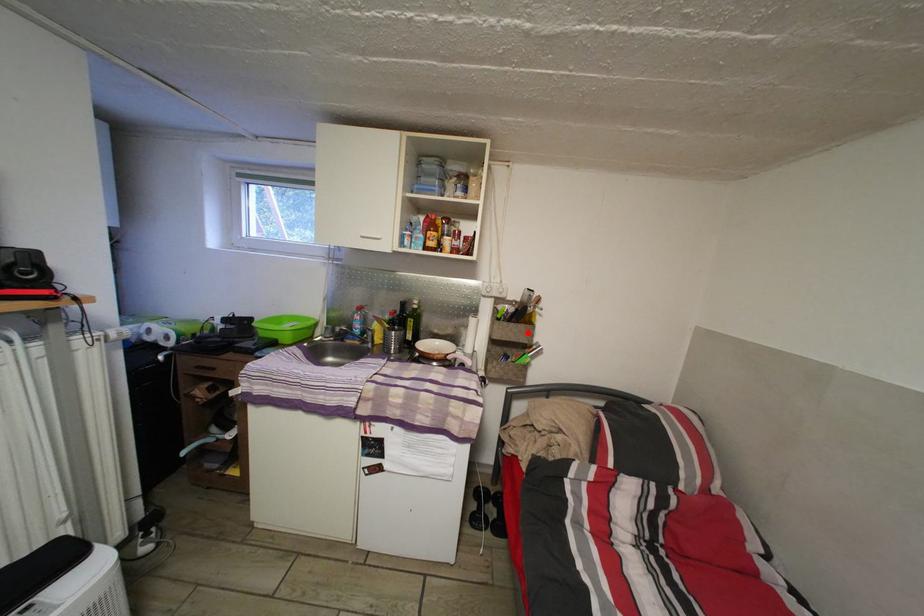
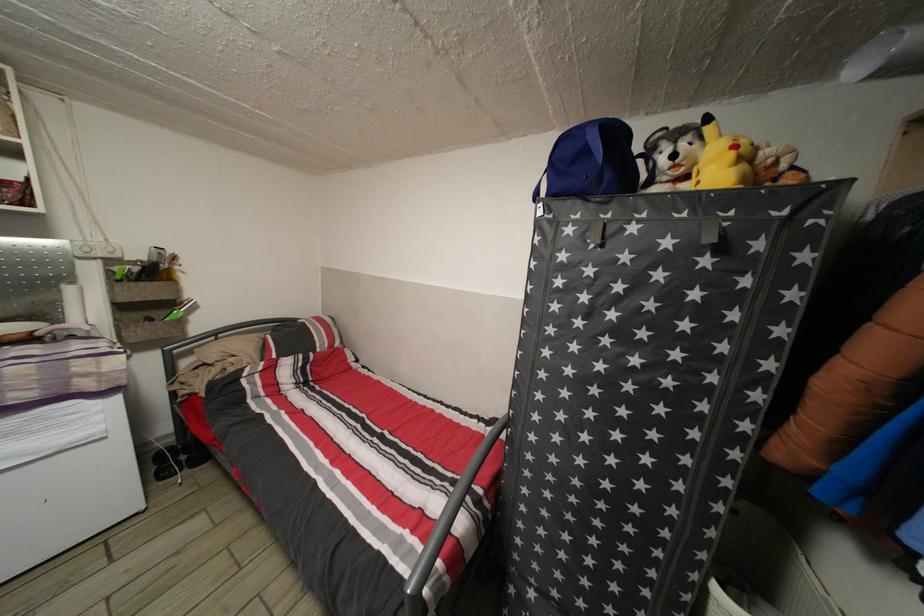
The point at the highlighted location is marked in the first image. Where is the corresponding point in the second image?

(164, 291)